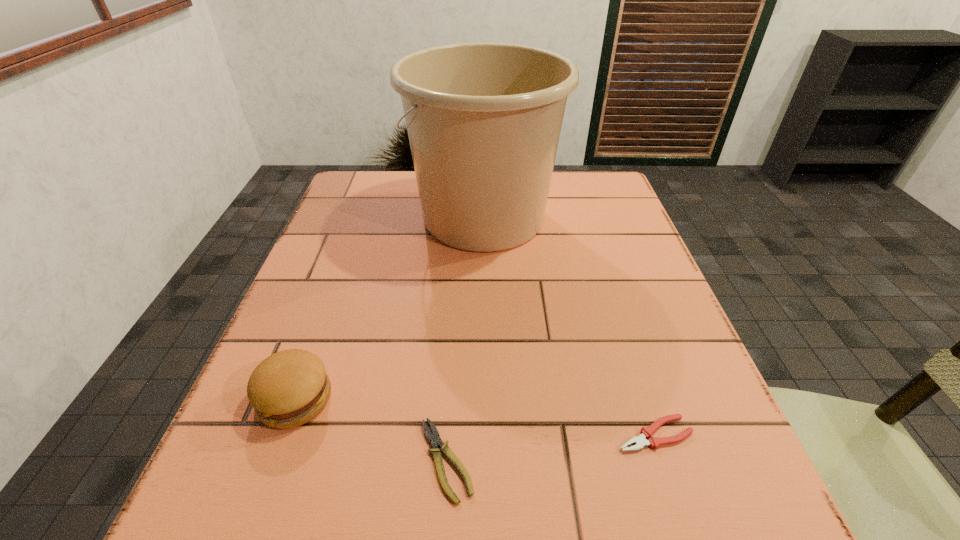
Where is `object located in the far edge section of the desktop`? Image resolution: width=960 pixels, height=540 pixels. object located in the far edge section of the desktop is located at coordinates (484, 119).

Find the location of a particular element. The width and height of the screenshot is (960, 540). object that is at the near edge is located at coordinates (434, 439).

In order to click on object present at the left edge in this screenshot , I will do `click(289, 388)`.

Where is `object at the right edge`? The width and height of the screenshot is (960, 540). object at the right edge is located at coordinates (646, 432).

The height and width of the screenshot is (540, 960). In order to click on blank area at the far edge in this screenshot , I will do `click(403, 206)`.

The image size is (960, 540). I want to click on free spot at the near edge of the desktop, so click(614, 491).

At what (x,y) coordinates should I click in order to perform the action: click on free point at the left edge. Please return your answer as a coordinate pair (x, y). Looking at the image, I should click on click(x=339, y=276).

The height and width of the screenshot is (540, 960). I want to click on vacant space at the right edge of the desktop, so click(679, 460).

Identify the location of vacant space at the far left corner. The image size is (960, 540). (354, 194).

This screenshot has height=540, width=960. In order to click on free space at the far right corner of the desktop in this screenshot , I will do `click(630, 213)`.